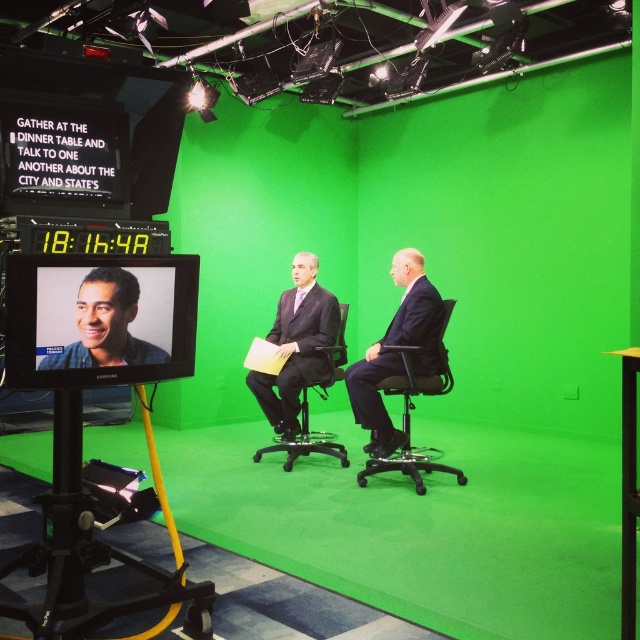
You are a camera operator in the studio. You need to adjust the camera to focus on both the matte black suit at center and the matte blue shirt at left simultaneously. The camera has a maximum focus range of 2.5 meters. Can you fit both subjects into the frame without moving the camera?

The matte black suit at center is 2.51 meters from the matte blue shirt at left, which exceeds the camera maximum focus range of 2.5 meters. Therefore, you cannot fit both subjects into the frame without moving the camera.

You are a costume designer trying to choose between the matte black suit at center and the matte blue shirt at left for a client. The client prefers a larger size. Which option should you recommend?

The matte black suit at center is larger in size than the matte blue shirt at left, so you should recommend the matte black suit at center.